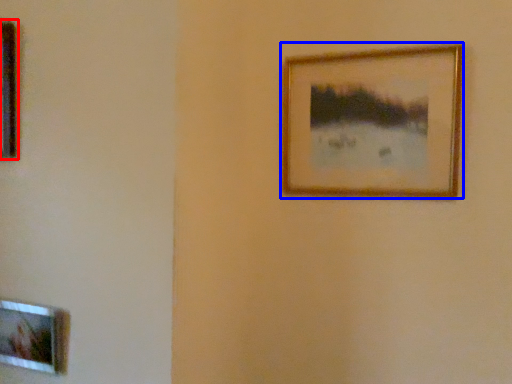
Question: Which point is closer to the camera, picture frame (highlighted by a red box) or picture frame (highlighted by a blue box)?

Choices:
 (A) picture frame
 (B) picture frame

Answer: (A)